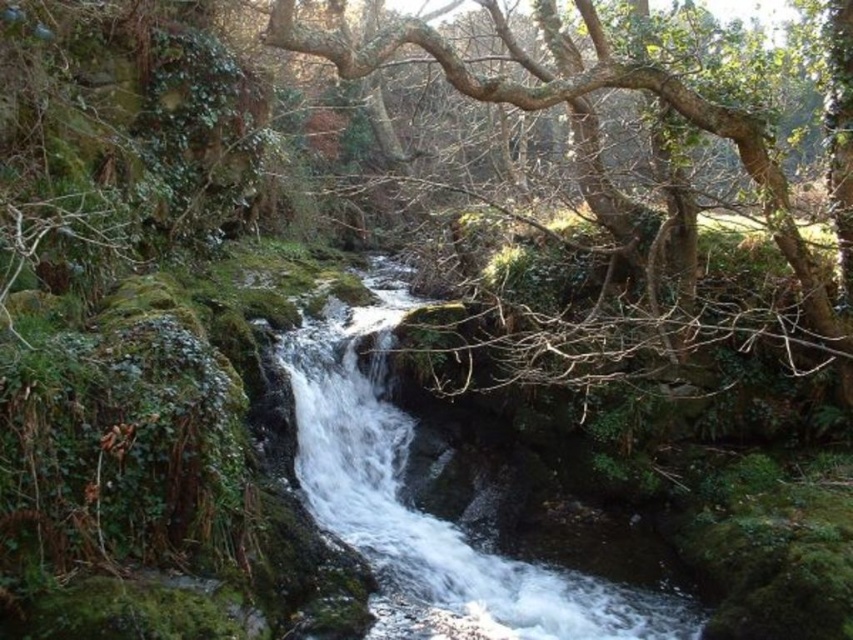
You are standing at the edge of the waterfall and want to know if you can walk around the white frothy water at center without stepping on the green leafy tree at center. Can you do that?

The white frothy water at center is wider than the green leafy tree at center, so you can walk around it without stepping on the tree.

You are a hiker standing at the edge of the waterfall and want to place a 5 meter long rope between the white frothy water at center and the green leafy tree at center. Is the distance sufficient to stretch the rope without any slack?

The white frothy water at center is 4.46 meters away from the green leafy tree at center. Since the rope is 5 meters long, the distance between them is shorter than the rope, so there will be some slack when stretched between them.

You are standing at the point closest to you in the image. Which point are you at, point [387,464] or point [376,49]?

You are at point [376,49] because it is closer to you than point [387,464], which is behind it.